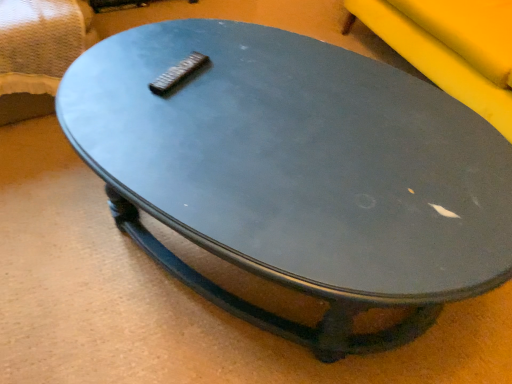
Describe the element at coordinates (178, 74) in the screenshot. The width and height of the screenshot is (512, 384). I see `black plastic remote at center` at that location.

The height and width of the screenshot is (384, 512). What are the coordinates of `black plastic remote at center` in the screenshot? It's located at (178, 74).

I want to click on black plastic remote at center, so click(178, 74).